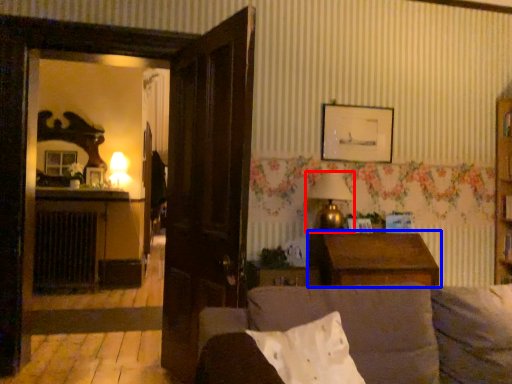
Question: Which object is further to the camera taking this photo, lamp (highlighted by a red box) or table (highlighted by a blue box)?

Choices:
 (A) lamp
 (B) table

Answer: (A)